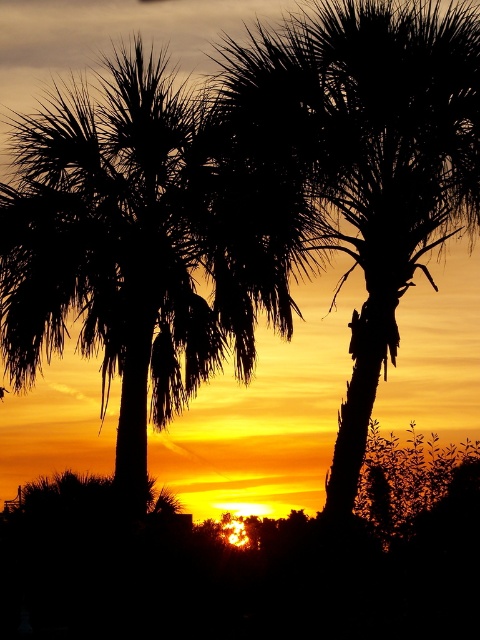
You are an artist trying to paint the sunset scene. You notice two palm trees in the image. Which palm tree, the black silhouette palm tree at left or the black textured palm tree at center, is positioned lower in the image?

The black silhouette palm tree at left is positioned lower than the black textured palm tree at center in the image.

You are planning to take a photo of the sunset with both the black silhouette palm tree at left and the black textured palm tree at center in the frame. Which tree should you position closer to the center of the photo to ensure both are visible without cropping?

You should position the black silhouette palm tree at left closer to the center of the photo because it is taller than the black textured palm tree at center, allowing both to fit within the frame without cropping.

You are a photographer trying to capture the sunset scene. You notice two palm trees in the frame. Which palm tree, the black silhouette palm tree at left or the black textured palm tree at center, is located more to the left?

The black silhouette palm tree at left is more to the left than the black textured palm tree at center because it is positioned on the left side of the latter.